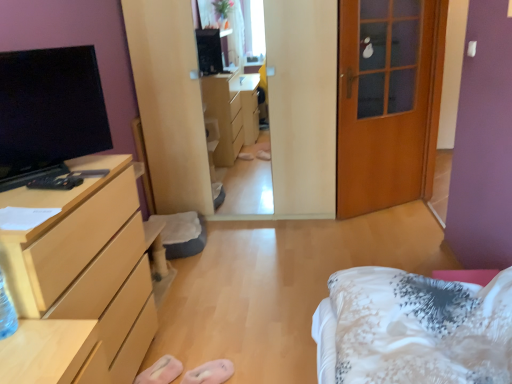
This screenshot has height=384, width=512. Describe the element at coordinates (49, 112) in the screenshot. I see `black glossy tv at left` at that location.

Identify the location of wooden door at right. pyautogui.click(x=388, y=101).

Measure the distance between wooden door at right and camera.

A distance of 9.52 feet exists between wooden door at right and camera.

Find the location of a particular element. black glossy tv at left is located at coordinates (49, 112).

Can you confirm if wooden door at right is bigger than white floral fabric bed at lower right?

Actually, wooden door at right might be smaller than white floral fabric bed at lower right.

Which object is positioned more to the right, wooden door at right or white floral fabric bed at lower right?

From the viewer's perspective, wooden door at right appears more on the right side.

Based on the photo, in terms of height, does wooden door at right look taller or shorter compared to white floral fabric bed at lower right?

Considering their sizes, wooden door at right has more height than white floral fabric bed at lower right.

In the scene shown: Measure the distance between pink fabric slipper at lower center, positioned as the 1th shoe in right-to-left order, and light wood/finish chest of drawers at left.

pink fabric slipper at lower center, positioned as the 1th shoe in right-to-left order, is 25.95 inches from light wood/finish chest of drawers at left.

Consider the image. Is pink fabric slipper at lower center, the 2th shoe positioned from the left, in front of or behind light wood/finish chest of drawers at left in the image?

pink fabric slipper at lower center, the 2th shoe positioned from the left, is behind light wood/finish chest of drawers at left.

Is pink fabric slipper at lower center, the 2th shoe positioned from the left, facing towards light wood/finish chest of drawers at left?

No, pink fabric slipper at lower center, the 2th shoe positioned from the left, is not oriented towards light wood/finish chest of drawers at left.

From the image's perspective, is pink fabric slipper at lower center, the 2th shoe positioned from the left, located beneath light wood/finish chest of drawers at left?

Yes, from the image's perspective, pink fabric slipper at lower center, the 2th shoe positioned from the left, is beneath light wood/finish chest of drawers at left.

From a real-world perspective, who is located lower, pink fabric slipper at lower center, the 2th shoe positioned from the left, or white floral fabric bed at lower right?

pink fabric slipper at lower center, the 2th shoe positioned from the left, from a real-world perspective.

Considering the sizes of pink fabric slipper at lower center, the 2th shoe positioned from the left, and white floral fabric bed at lower right in the image, is pink fabric slipper at lower center, the 2th shoe positioned from the left, bigger or smaller than white floral fabric bed at lower right?

In the image, pink fabric slipper at lower center, the 2th shoe positioned from the left, appears to be smaller than white floral fabric bed at lower right.

Based on the photo, who is shorter, pink fabric slipper at lower center, the 2th shoe positioned from the left, or white floral fabric bed at lower right?

pink fabric slipper at lower center, the 2th shoe positioned from the left.

How many degrees apart are the facing directions of white floral fabric bed at lower right and pink fabric slipper at lower center, the 2th shoe positioned from the left?

They differ by 49 degrees in their facing directions.

Which shoe is the 1st one when counting from the left side of the white floral fabric bed at lower right? Please provide its 2D coordinates.

[(210, 372)]

Looking at the image, does white floral fabric bed at lower right seem bigger or smaller compared to pink fabric slipper at lower center, positioned as the 1th shoe in right-to-left order?

Considering their sizes, white floral fabric bed at lower right takes up more space than pink fabric slipper at lower center, positioned as the 1th shoe in right-to-left order.

Based on the photo, considering the relative sizes of white floral fabric bed at lower right and pink fabric slipper at lower center, the second shoe in the right-to-left sequence, in the image provided, is white floral fabric bed at lower right bigger than pink fabric slipper at lower center, the second shoe in the right-to-left sequence,?

Indeed, white floral fabric bed at lower right has a larger size compared to pink fabric slipper at lower center, the second shoe in the right-to-left sequence.

Based on the photo, how many degrees apart are the facing directions of white floral fabric bed at lower right and pink fabric slipper at lower center, the second shoe in the right-to-left sequence?

There is a 49-degree angle between the facing directions of white floral fabric bed at lower right and pink fabric slipper at lower center, the second shoe in the right-to-left sequence.

From the image's perspective, relative to pink fabric slipper at lower center, marked as the 1th shoe in a left-to-right arrangement, is white floral fabric bed at lower right above or below?

white floral fabric bed at lower right is above pink fabric slipper at lower center, marked as the 1th shoe in a left-to-right arrangement.

Based on their positions, is white floral fabric bed at lower right located to the left or right of pink fabric slipper at lower center, the second shoe in the right-to-left sequence?

Clearly, white floral fabric bed at lower right is on the right of pink fabric slipper at lower center, the second shoe in the right-to-left sequence, in the image.

Between point (110, 243) and point (346, 358), which one is positioned in front?

The point (346, 358) is closer.

Which is correct: light wood/finish chest of drawers at left is inside white floral fabric bed at lower right, or outside of it?

light wood/finish chest of drawers at left is spatially situated outside white floral fabric bed at lower right.

The width and height of the screenshot is (512, 384). Identify the location of bed in front of the light wood/finish chest of drawers at left. (413, 329).

From a real-world perspective, is light wood/finish chest of drawers at left over white floral fabric bed at lower right?

No, from a real-world perspective, light wood/finish chest of drawers at left is not above white floral fabric bed at lower right.

There is a pink fabric slipper at lower center, the 2th shoe positioned from the left. Identify the location of shoe above it (from a real-world perspective). This screenshot has width=512, height=384. (161, 371).

From the image's perspective, is pink fabric slipper at lower center, the second shoe in the right-to-left sequence, above or below pink fabric slipper at lower center, positioned as the 1th shoe in right-to-left order?

pink fabric slipper at lower center, the second shoe in the right-to-left sequence, is below pink fabric slipper at lower center, positioned as the 1th shoe in right-to-left order.

Considering the relative positions of pink fabric slipper at lower center, marked as the 1th shoe in a left-to-right arrangement, and pink fabric slipper at lower center, the 2th shoe positioned from the left, in the image provided, is pink fabric slipper at lower center, marked as the 1th shoe in a left-to-right arrangement, behind pink fabric slipper at lower center, the 2th shoe positioned from the left,?

That is True.

Are pink fabric slipper at lower center, the second shoe in the right-to-left sequence, and pink fabric slipper at lower center, the 2th shoe positioned from the left, beside each other?

pink fabric slipper at lower center, the second shoe in the right-to-left sequence, and pink fabric slipper at lower center, the 2th shoe positioned from the left, are clearly separated.

At what (x,y) coordinates should I click in order to perform the action: click on bed directly beneath the wooden door at right (from a real-world perspective). Please return your answer as a coordinate pair (x, y). The image size is (512, 384). Looking at the image, I should click on (413, 329).

This screenshot has width=512, height=384. Find the location of `the 1st shoe below when counting from the light wood/finish chest of drawers at left (from the image's perspective)`. the 1st shoe below when counting from the light wood/finish chest of drawers at left (from the image's perspective) is located at coordinates (210, 372).

When comparing their distances from wooden door at right, does black glossy tv at left or light wood/finish chest of drawers at left seem further?

Among the two, light wood/finish chest of drawers at left is located further to wooden door at right.

Based on their spatial positions, is black glossy tv at left or wooden door at right closer to pink fabric slipper at lower center, the 2th shoe positioned from the left?

black glossy tv at left is closer to pink fabric slipper at lower center, the 2th shoe positioned from the left.

Considering their positions, is white floral fabric bed at lower right positioned closer to black glossy tv at left than pink fabric slipper at lower center, positioned as the 1th shoe in right-to-left order?

pink fabric slipper at lower center, positioned as the 1th shoe in right-to-left order, is positioned closer to the anchor black glossy tv at left.

Looking at this image, when comparing their distances from black glossy tv at left, does pink fabric slipper at lower center, the second shoe in the right-to-left sequence, or wooden door at right seem further?

wooden door at right is positioned further to the anchor black glossy tv at left.

From the image, which object appears to be nearer to wooden door at right, black glossy tv at left or pink fabric slipper at lower center, the second shoe in the right-to-left sequence?

black glossy tv at left lies closer to wooden door at right than the other object.

Looking at the image, which one is located closer to black glossy tv at left, pink fabric slipper at lower center, the 2th shoe positioned from the left, or wooden door at right?

pink fabric slipper at lower center, the 2th shoe positioned from the left, is closer to black glossy tv at left.

Estimate the real-world distances between objects in this image. Which object is further from pink fabric slipper at lower center, marked as the 1th shoe in a left-to-right arrangement, black glossy tv at left or pink fabric slipper at lower center, the 2th shoe positioned from the left?

black glossy tv at left is positioned further to the anchor pink fabric slipper at lower center, marked as the 1th shoe in a left-to-right arrangement.

Estimate the real-world distances between objects in this image. Which object is further from pink fabric slipper at lower center, the 2th shoe positioned from the left, wooden door at right or light wood/finish chest of drawers at left?

Based on the image, wooden door at right appears to be further to pink fabric slipper at lower center, the 2th shoe positioned from the left.

Identify the location of shoe between wooden door at right and pink fabric slipper at lower center, marked as the 1th shoe in a left-to-right arrangement, in the vertical direction. (210, 372).

Locate an element on the screen. The width and height of the screenshot is (512, 384). shoe between black glossy tv at left and pink fabric slipper at lower center, the second shoe in the right-to-left sequence, vertically is located at coordinates (210, 372).

This screenshot has width=512, height=384. Find the location of `television located between light wood/finish chest of drawers at left and white floral fabric bed at lower right in the left-right direction`. television located between light wood/finish chest of drawers at left and white floral fabric bed at lower right in the left-right direction is located at coordinates (49, 112).

I want to click on shoe between pink fabric slipper at lower center, the second shoe in the right-to-left sequence, and white floral fabric bed at lower right from left to right, so click(x=210, y=372).